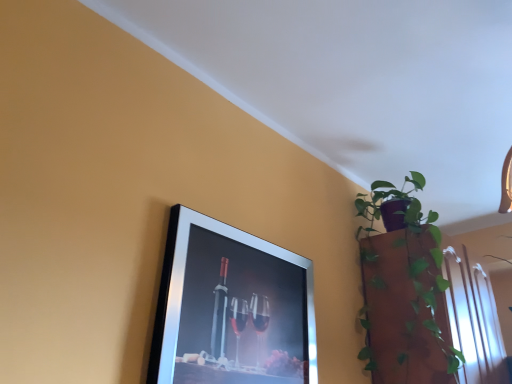
Question: From a real-world perspective, is green glossy plant at upper right above or below silver metallic picture frame at upper left?

Choices:
 (A) below
 (B) above

Answer: (B)

Question: Relative to silver metallic picture frame at upper left, is green glossy plant at upper right in front or behind?

Choices:
 (A) behind
 (B) front

Answer: (A)

Question: In terms of size, does green glossy plant at upper right appear bigger or smaller than silver metallic picture frame at upper left?

Choices:
 (A) small
 (B) big

Answer: (B)

Question: Is point (243, 334) positioned closer to the camera than point (421, 299)?

Choices:
 (A) farther
 (B) closer

Answer: (B)

Question: Is silver metallic picture frame at upper left wider or thinner than green glossy plant at upper right?

Choices:
 (A) wide
 (B) thin

Answer: (B)

Question: Considering the positions of silver metallic picture frame at upper left and green glossy plant at upper right in the image, is silver metallic picture frame at upper left taller or shorter than green glossy plant at upper right?

Choices:
 (A) tall
 (B) short

Answer: (B)

Question: From a real-world perspective, is silver metallic picture frame at upper left positioned above or below green glossy plant at upper right?

Choices:
 (A) below
 (B) above

Answer: (A)